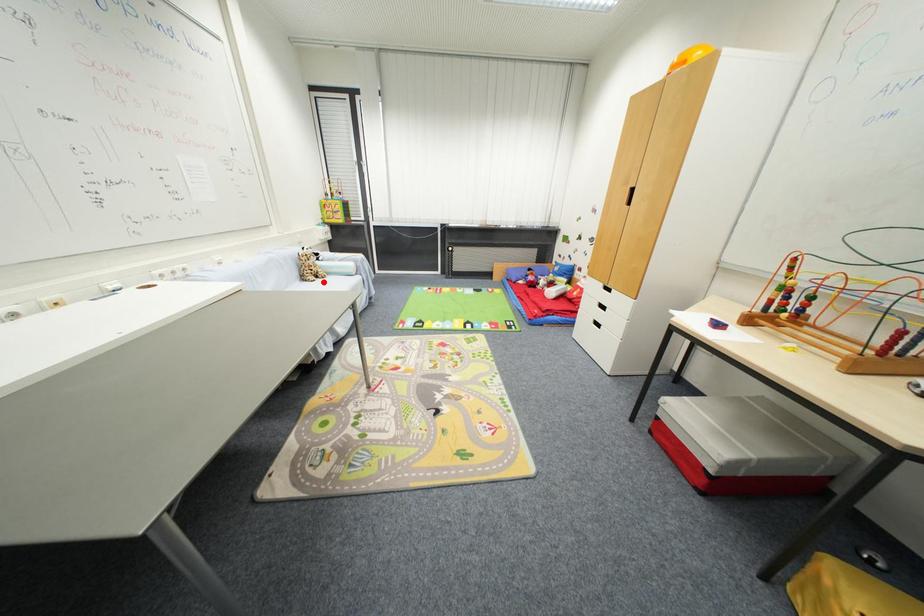
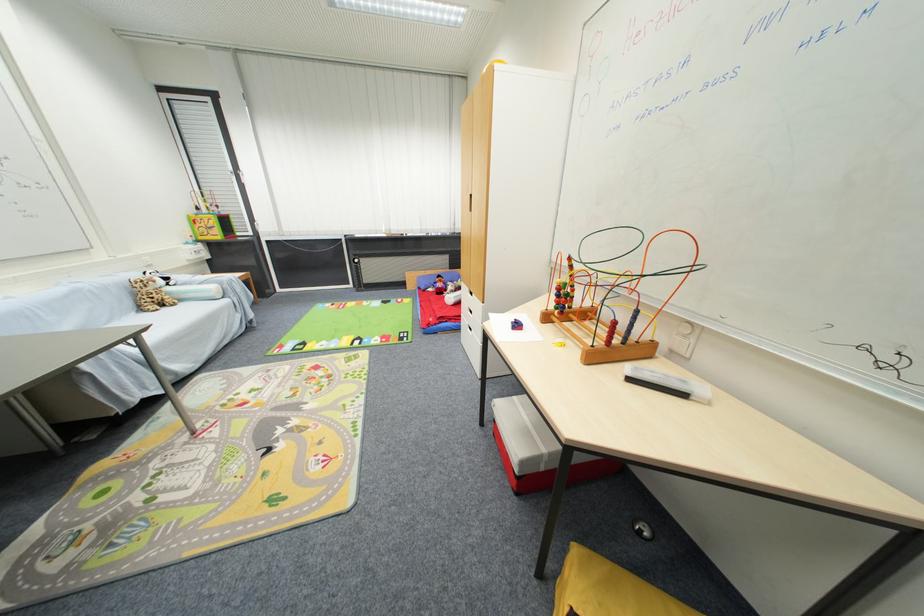
Locate, in the second image, the point that corresponds to the highlighted location in the first image.

(171, 310)